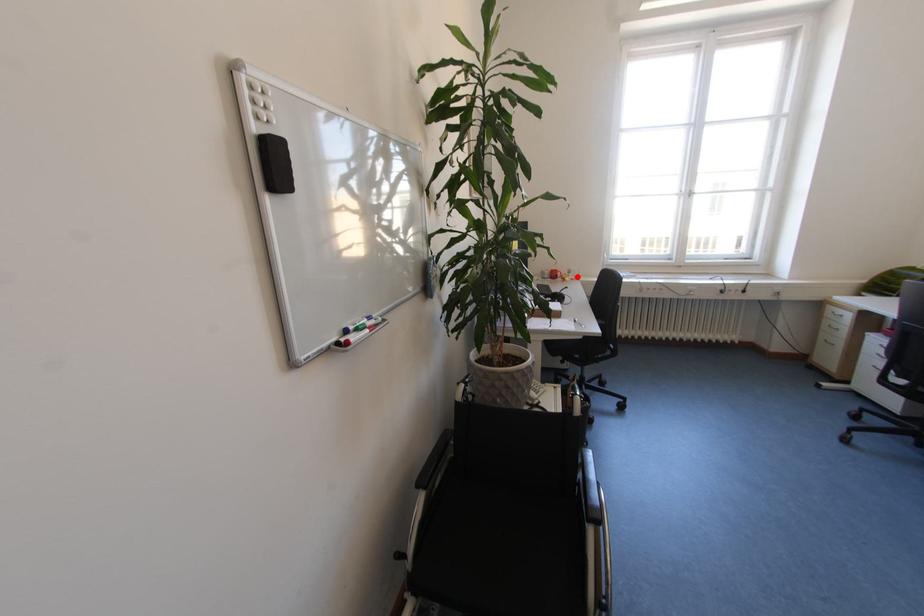
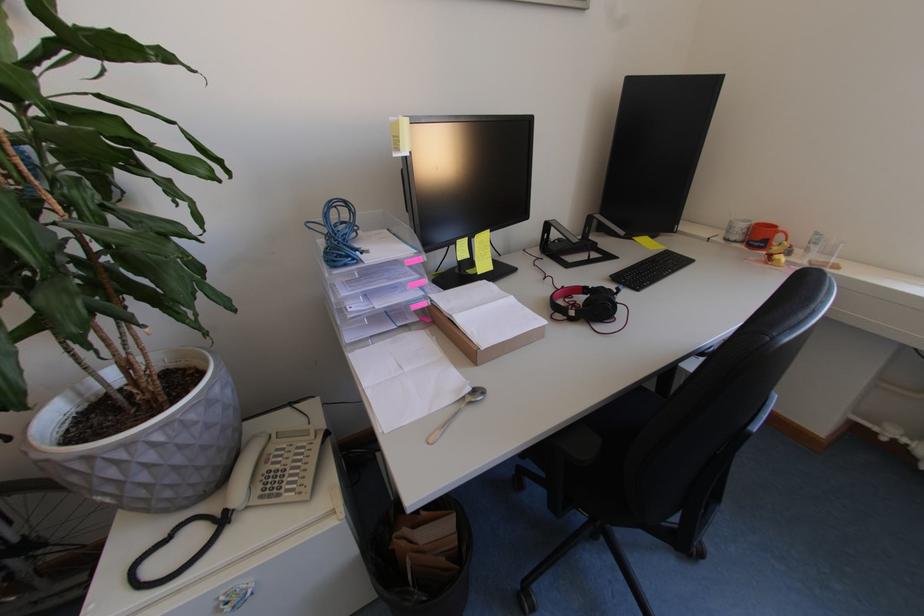
Where in the second image is the point corresponding to the highlighted location from the first image?

(816, 253)